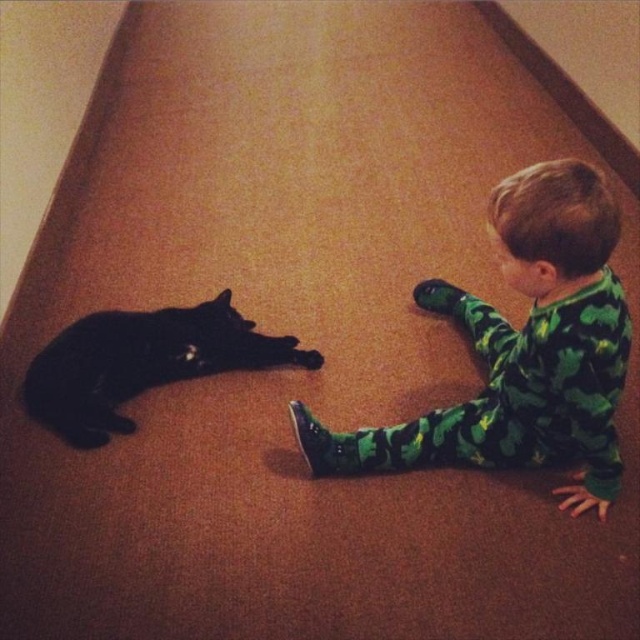
Question: Can you confirm if black fur cat at left is positioned to the right of green matte paw at lower center?

Choices:
 (A) yes
 (B) no

Answer: (B)

Question: Among these points, which one is farthest from the camera?

Choices:
 (A) (40, 385)
 (B) (577, 384)
 (C) (445, 294)

Answer: (C)

Question: Which object is positioned closest to the green matte paw at lower center?

Choices:
 (A) green camouflage pajamas at lower right
 (B) black fur cat at left

Answer: (A)

Question: Where is green camouflage pajamas at lower right located in relation to black fur cat at left in the image?

Choices:
 (A) above
 (B) below

Answer: (A)

Question: Considering the real-world distances, which object is farthest from the green camouflage pajamas at lower right?

Choices:
 (A) green matte paw at lower center
 (B) black fur cat at left

Answer: (B)

Question: Is green camouflage pajamas at lower right thinner than black fur cat at left?

Choices:
 (A) yes
 (B) no

Answer: (A)